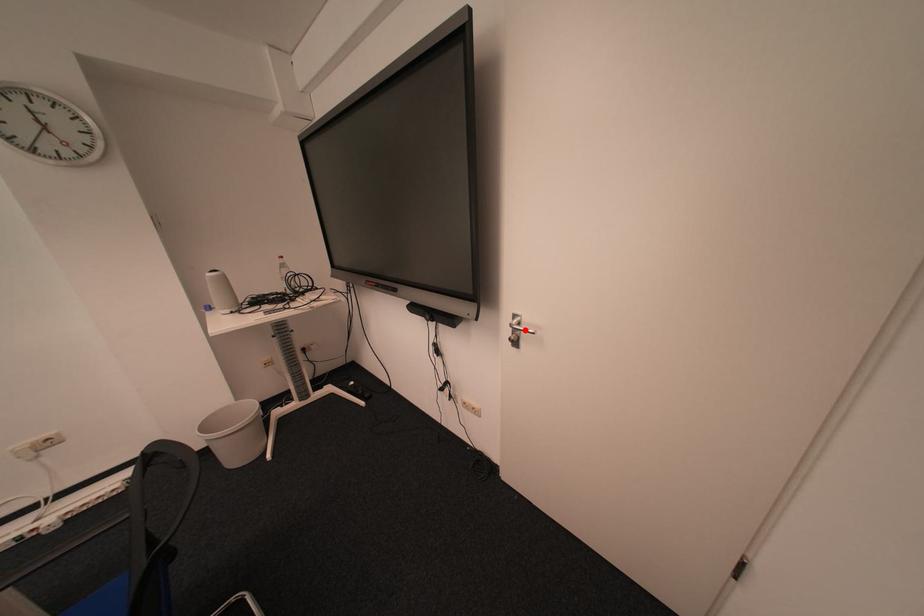
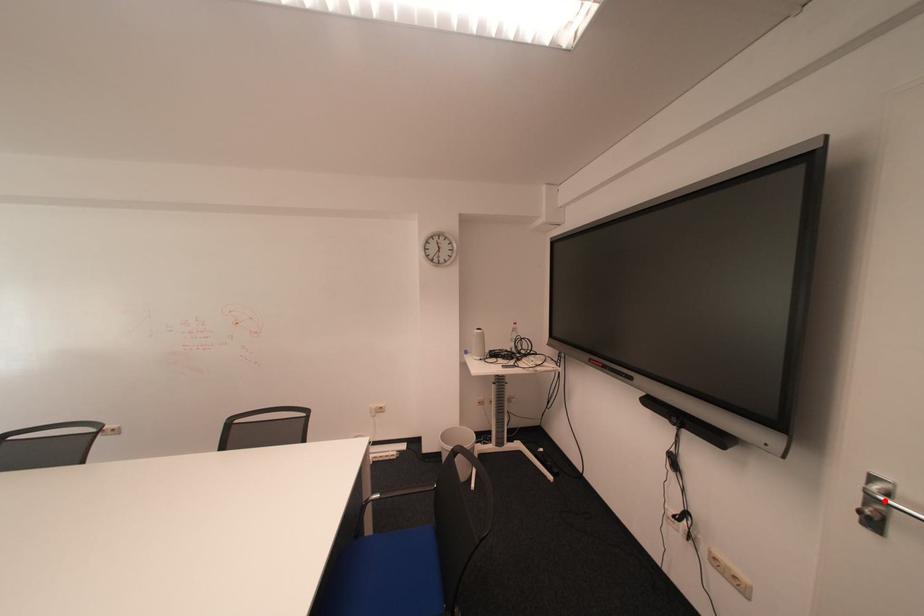
I am providing you with two images of the same scene from different viewpoints. A red point is marked on the first image and another point is marked on the second image. Are the points marked in image1 and image2 representing the same 3D position?

Yes